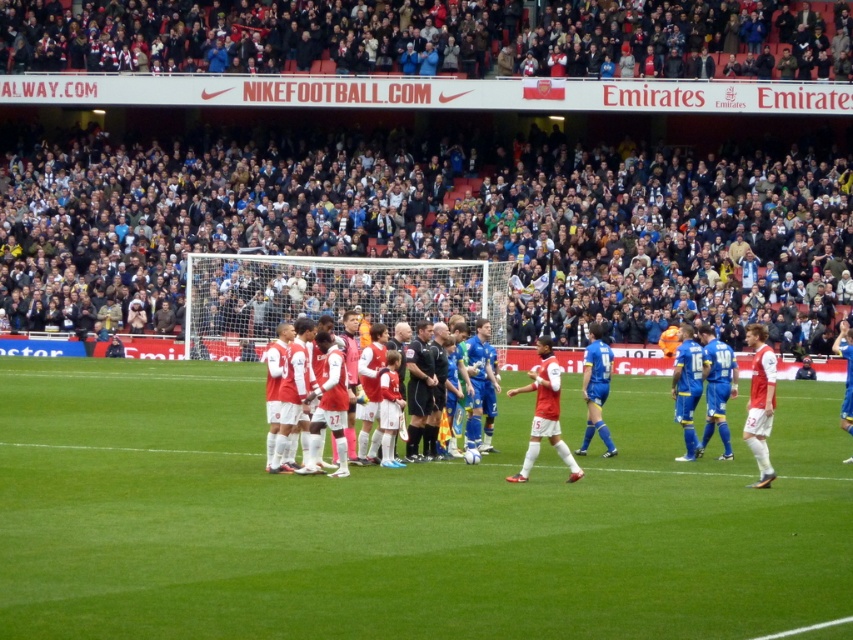
Question: Which object appears closest to the camera in this image?

Choices:
 (A) dark gray stadium seats at upper center
 (B) white jersey soccer players at center
 (C) dark gray fabric crowd at upper center
 (D) green grass football field at center

Answer: (D)

Question: Which of the following is the farthest from the observer?

Choices:
 (A) green grass football field at center
 (B) white matte jersey at center
 (C) dark gray stadium seats at upper center

Answer: (C)

Question: Where is dark gray fabric crowd at upper center located in relation to dark gray stadium seats at upper center in the image?

Choices:
 (A) right
 (B) left

Answer: (B)

Question: Can you confirm if dark gray fabric crowd at upper center is wider than dark gray stadium seats at upper center?

Choices:
 (A) no
 (B) yes

Answer: (B)

Question: Does dark gray fabric crowd at upper center have a greater width compared to white matte jersey at center?

Choices:
 (A) no
 (B) yes

Answer: (B)

Question: Which point appears farthest from the camera in this image?

Choices:
 (A) pos(521,612)
 (B) pos(383,6)

Answer: (B)